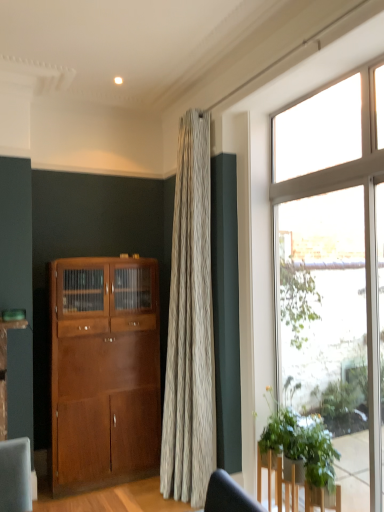
What is the approximate width of green leafy plant at lower right?

It is 8.27 inches.

The height and width of the screenshot is (512, 384). Describe the element at coordinates (333, 271) in the screenshot. I see `clear glass window at right` at that location.

Measure the distance between shiny brown cabinet at left and camera.

shiny brown cabinet at left is 10.33 feet away from camera.

Image resolution: width=384 pixels, height=512 pixels. What do you see at coordinates (104, 371) in the screenshot?
I see `shiny brown cabinet at left` at bounding box center [104, 371].

Where is `green leafy plant at lower right`? green leafy plant at lower right is located at coordinates (298, 458).

Between clear glass window at right and shiny brown cabinet at left, which one has smaller size?

Smaller between the two is clear glass window at right.

Is shiny brown cabinet at left inside clear glass window at right?

That's incorrect, shiny brown cabinet at left is not inside clear glass window at right.

Consider the image. From a real-world perspective, which object stands above the other?

From a 3D spatial view, clear glass window at right is above.

Considering the relative positions of clear glass window at right and shiny brown cabinet at left in the image provided, is clear glass window at right behind shiny brown cabinet at left?

No, the depth of clear glass window at right is less than that of shiny brown cabinet at left.

This screenshot has width=384, height=512. Identify the location of window that appears on the right of green leafy plant at lower right. (333, 271).

Can you confirm if green leafy plant at lower right is shorter than clear glass window at right?

Correct, green leafy plant at lower right is not as tall as clear glass window at right.

How many degrees apart are the facing directions of green leafy plant at lower right and clear glass window at right?

They differ by 2.66 degrees in their facing directions.

Is green leafy plant at lower right next to clear glass window at right and touching it?

They are not placed beside each other.

Is shiny brown cabinet at left at the right side of green leafy plant at lower right?

No.

Is shiny brown cabinet at left not near green leafy plant at lower right?

Absolutely, shiny brown cabinet at left is distant from green leafy plant at lower right.

Is shiny brown cabinet at left turned away from green leafy plant at lower right?

That's not correct — shiny brown cabinet at left is not looking away from green leafy plant at lower right.

In order to click on cabinetry behind the green leafy plant at lower right in this screenshot , I will do `click(104, 371)`.

In the scene shown: Between clear glass window at right and green leafy plant at lower right, which one has smaller size?

green leafy plant at lower right.

Which is correct: clear glass window at right is inside green leafy plant at lower right, or outside of it?

clear glass window at right is not enclosed by green leafy plant at lower right.

The image size is (384, 512). Identify the location of window that appears above the green leafy plant at lower right (from the image's perspective). (333, 271).

From a real-world perspective, is clear glass window at right physically located above or below green leafy plant at lower right?

From a real-world perspective, clear glass window at right is physically above green leafy plant at lower right.

Is green leafy plant at lower right outside of shiny brown cabinet at left?

Yes, green leafy plant at lower right is located beyond the bounds of shiny brown cabinet at left.

Does green leafy plant at lower right appear on the right side of shiny brown cabinet at left?

Correct, you'll find green leafy plant at lower right to the right of shiny brown cabinet at left.

From a real-world perspective, which is physically below, green leafy plant at lower right or shiny brown cabinet at left?

green leafy plant at lower right is physically lower.

Which object is closer to the camera, green leafy plant at lower right or shiny brown cabinet at left?

green leafy plant at lower right is closer to the camera.

This screenshot has height=512, width=384. In order to click on window on the right of shiny brown cabinet at left in this screenshot , I will do `click(333, 271)`.

Considering the sizes of shiny brown cabinet at left and clear glass window at right in the image, is shiny brown cabinet at left bigger or smaller than clear glass window at right?

shiny brown cabinet at left is bigger than clear glass window at right.

Is shiny brown cabinet at left facing towards clear glass window at right?

No, shiny brown cabinet at left is not oriented towards clear glass window at right.

Is shiny brown cabinet at left taller than clear glass window at right?

No, shiny brown cabinet at left is not taller than clear glass window at right.

In the image, there is a clear glass window at right. Identify the location of cabinetry below it (from the image's perspective). The height and width of the screenshot is (512, 384). (104, 371).

There is a green leafy plant at lower right. What are the coordinates of `window above it (from a real-world perspective)` in the screenshot? It's located at (333, 271).

Based on their spatial positions, is clear glass window at right or green leafy plant at lower right closer to shiny brown cabinet at left?

green leafy plant at lower right is positioned closer to the anchor shiny brown cabinet at left.

Estimate the real-world distances between objects in this image. Which object is further from clear glass window at right, green leafy plant at lower right or shiny brown cabinet at left?

shiny brown cabinet at left.

Considering their positions, is shiny brown cabinet at left positioned closer to clear glass window at right than green leafy plant at lower right?

The object closer to clear glass window at right is green leafy plant at lower right.

Based on their spatial positions, is green leafy plant at lower right or clear glass window at right closer to shiny brown cabinet at left?

The object closer to shiny brown cabinet at left is green leafy plant at lower right.

Considering their positions, is clear glass window at right positioned closer to green leafy plant at lower right than shiny brown cabinet at left?

clear glass window at right is closer to green leafy plant at lower right.

Based on their spatial positions, is shiny brown cabinet at left or clear glass window at right further from green leafy plant at lower right?

shiny brown cabinet at left lies further to green leafy plant at lower right than the other object.

Locate an element on the screen. The width and height of the screenshot is (384, 512). houseplant between shiny brown cabinet at left and clear glass window at right from left to right is located at coordinates (298, 458).